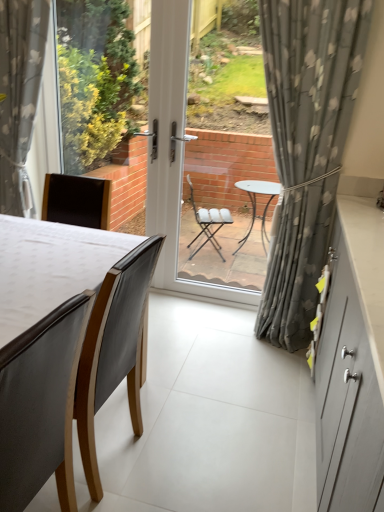
Question: From a real-world perspective, does dark brown leather chair at lower left, placed as the first chair when sorted from front to back, stand above gray floral fabric curtain at left, which is the second curtain from right to left?

Choices:
 (A) yes
 (B) no

Answer: (B)

Question: Is dark brown leather chair at lower left, placed as the first chair when sorted from front to back, taller than gray floral fabric curtain at left, which is the second curtain from right to left?

Choices:
 (A) yes
 (B) no

Answer: (B)

Question: Are dark brown leather chair at lower left, the 2th chair from the back, and gray floral fabric curtain at left, acting as the first curtain starting from the left, far apart?

Choices:
 (A) no
 (B) yes

Answer: (B)

Question: Can you confirm if dark brown leather chair at lower left, the 2th chair from the back, is positioned to the left of gray floral fabric curtain at left, which is the second curtain from right to left?

Choices:
 (A) yes
 (B) no

Answer: (B)

Question: Can you confirm if dark brown leather chair at lower left, placed as the first chair when sorted from front to back, is smaller than gray floral fabric curtain at left, which is the second curtain from right to left?

Choices:
 (A) yes
 (B) no

Answer: (B)

Question: In terms of size, does dark brown leather chair at lower left, placed as the first chair when sorted from front to back, appear bigger or smaller than matte black chair at left, which ranks as the first chair in back-to-front order?

Choices:
 (A) small
 (B) big

Answer: (A)

Question: Considering their positions, is dark brown leather chair at lower left, the 2th chair from the back, located in front of or behind matte black chair at left, acting as the 2th chair starting from the front?

Choices:
 (A) behind
 (B) front

Answer: (B)

Question: Is dark brown leather chair at lower left, the 2th chair from the back, situated inside matte black chair at left, acting as the 2th chair starting from the front, or outside?

Choices:
 (A) inside
 (B) outside

Answer: (B)

Question: From a real-world perspective, relative to matte black chair at left, acting as the 2th chair starting from the front, is dark brown leather chair at lower left, the 2th chair from the back, vertically above or below?

Choices:
 (A) below
 (B) above

Answer: (B)

Question: From the image's perspective, is matte black chair at left, which ranks as the first chair in back-to-front order, located above or below matte gray cabinet at right?

Choices:
 (A) above
 (B) below

Answer: (B)

Question: Looking at their shapes, would you say matte black chair at left, acting as the 2th chair starting from the front, is wider or thinner than matte gray cabinet at right?

Choices:
 (A) thin
 (B) wide

Answer: (A)

Question: Is matte black chair at left, acting as the 2th chair starting from the front, inside the boundaries of matte gray cabinet at right, or outside?

Choices:
 (A) outside
 (B) inside

Answer: (A)

Question: Is matte black chair at left, which ranks as the first chair in back-to-front order, taller or shorter than matte gray cabinet at right?

Choices:
 (A) tall
 (B) short

Answer: (B)

Question: In terms of size, does matte black chair at left, which ranks as the first chair in back-to-front order, appear bigger or smaller than dark brown leather chair at lower left, placed as the first chair when sorted from front to back?

Choices:
 (A) small
 (B) big

Answer: (B)

Question: Considering the positions of point (94, 310) and point (46, 343), is point (94, 310) closer or farther from the camera than point (46, 343)?

Choices:
 (A) closer
 (B) farther

Answer: (B)